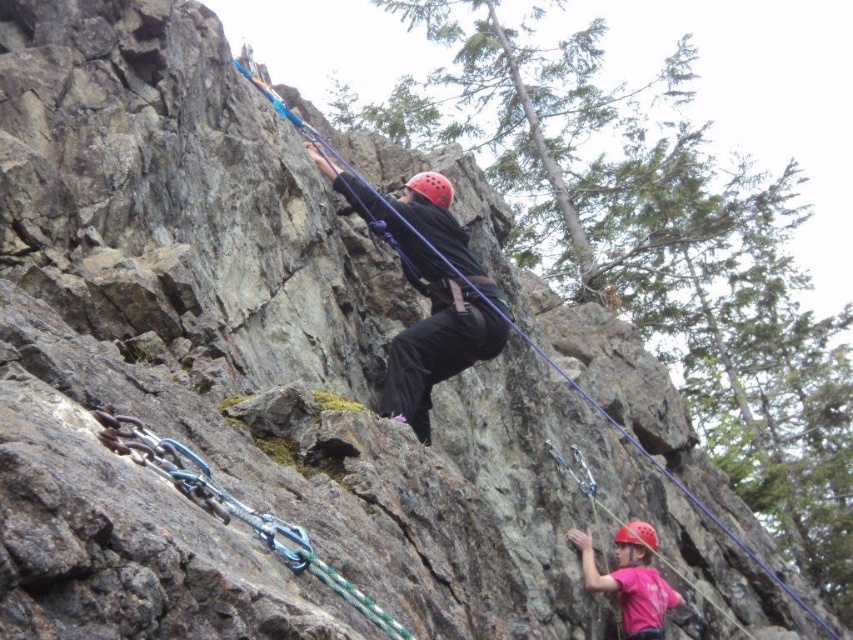
Question: Based on their relative distances, which object is farther from the pink fabric helmet at lower right?

Choices:
 (A) matte black helmet at center
 (B) green rope at center

Answer: (B)

Question: Can you confirm if pink fabric helmet at lower right is positioned to the right of red matte helmet at center?

Choices:
 (A) yes
 (B) no

Answer: (A)

Question: Among these points, which one is farthest from the camera?

Choices:
 (A) (624, 560)
 (B) (450, 326)

Answer: (A)

Question: Is matte black helmet at center above red matte helmet at center?

Choices:
 (A) no
 (B) yes

Answer: (A)

Question: Is matte black helmet at center wider than pink fabric helmet at lower right?

Choices:
 (A) no
 (B) yes

Answer: (B)

Question: Which of these objects is positioned closest to the matte black helmet at center?

Choices:
 (A) green rope at center
 (B) red matte helmet at center
 (C) pink fabric helmet at lower right
 (D) matte red helmet at lower right

Answer: (B)